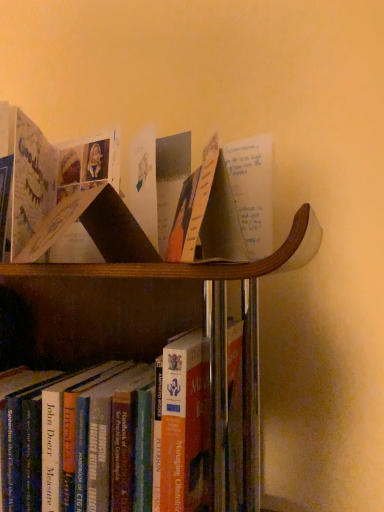
Question: Which direction should I rotate to look at matte paper book at center, which is counted as the second book, starting from the bottom?

Choices:
 (A) left
 (B) right

Answer: (A)

Question: Can you confirm if matte paper book at center is wider than hardcover book at lower center, which is counted as the 2th book, starting from the top?

Choices:
 (A) no
 (B) yes

Answer: (A)

Question: Is matte paper book at center surrounding hardcover book at lower center, which is the first book from bottom to top?

Choices:
 (A) yes
 (B) no

Answer: (B)

Question: Is matte paper book at center next to hardcover book at lower center, which is the first book from bottom to top?

Choices:
 (A) yes
 (B) no

Answer: (B)

Question: Is matte paper book at center in front of hardcover book at lower center, which is the first book from bottom to top?

Choices:
 (A) no
 (B) yes

Answer: (B)

Question: Is matte paper book at center at the left side of hardcover book at lower center, which is the first book from bottom to top?

Choices:
 (A) no
 (B) yes

Answer: (A)

Question: Can you confirm if matte paper book at center is shorter than hardcover book at lower center, which is counted as the 2th book, starting from the top?

Choices:
 (A) yes
 (B) no

Answer: (A)

Question: Is matte paper book at center, marked as the 1th book in a top-to-bottom arrangement, at the right side of matte paper book at center?

Choices:
 (A) no
 (B) yes

Answer: (A)

Question: From the image's perspective, is matte paper book at center, marked as the 1th book in a top-to-bottom arrangement, below matte paper book at center?

Choices:
 (A) no
 (B) yes

Answer: (B)

Question: From a real-world perspective, is matte paper book at center, which is counted as the second book, starting from the bottom, on matte paper book at center?

Choices:
 (A) no
 (B) yes

Answer: (A)

Question: Considering the relative positions of matte paper book at center, which is counted as the second book, starting from the bottom, and matte paper book at center in the image provided, is matte paper book at center, which is counted as the second book, starting from the bottom, in front of matte paper book at center?

Choices:
 (A) no
 (B) yes

Answer: (A)

Question: Is matte paper book at center, which is counted as the second book, starting from the bottom, positioned far away from matte paper book at center?

Choices:
 (A) no
 (B) yes

Answer: (A)

Question: Can we say matte paper book at center, which is counted as the second book, starting from the bottom, lies outside matte paper book at center?

Choices:
 (A) no
 (B) yes

Answer: (B)

Question: Is matte paper book at center thinner than matte paper book at center, which is counted as the second book, starting from the bottom?

Choices:
 (A) no
 (B) yes

Answer: (B)